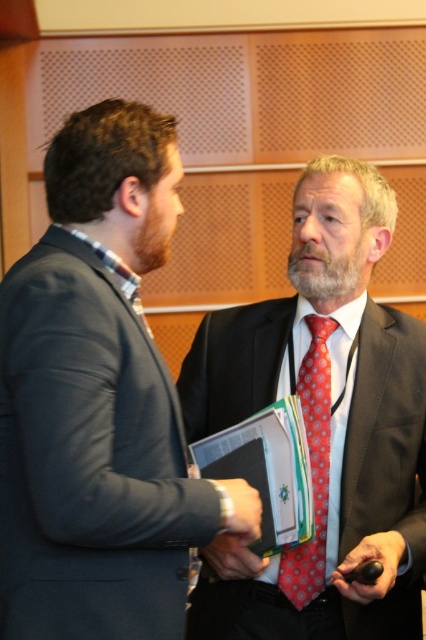
Question: Which object is positioned closest to the matte black suit at center?

Choices:
 (A) red dotted tie at center
 (B) matte black suit at left

Answer: (A)

Question: Can you confirm if matte black suit at center is smaller than red dotted tie at center?

Choices:
 (A) yes
 (B) no

Answer: (B)

Question: Is matte black suit at center closer to the viewer compared to red dotted tie at center?

Choices:
 (A) no
 (B) yes

Answer: (B)

Question: Among these objects, which one is farthest from the camera?

Choices:
 (A) matte black suit at center
 (B) red dotted tie at center
 (C) matte black suit at left

Answer: (B)

Question: Is matte black suit at center bigger than red dotted tie at center?

Choices:
 (A) yes
 (B) no

Answer: (A)

Question: Which of the following is the closest to the observer?

Choices:
 (A) (316, 376)
 (B) (37, 410)
 (C) (339, 164)

Answer: (B)